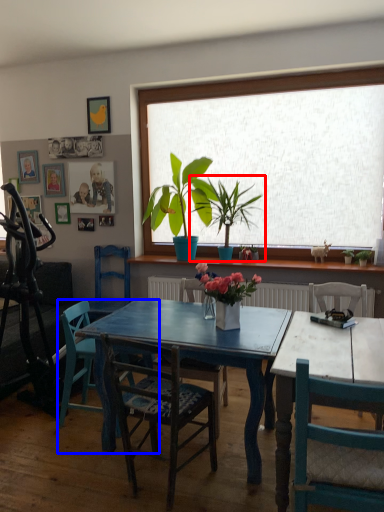
Question: Among these objects, which one is farthest to the camera, houseplant (highlighted by a red box) or chair (highlighted by a blue box)?

Choices:
 (A) houseplant
 (B) chair

Answer: (A)